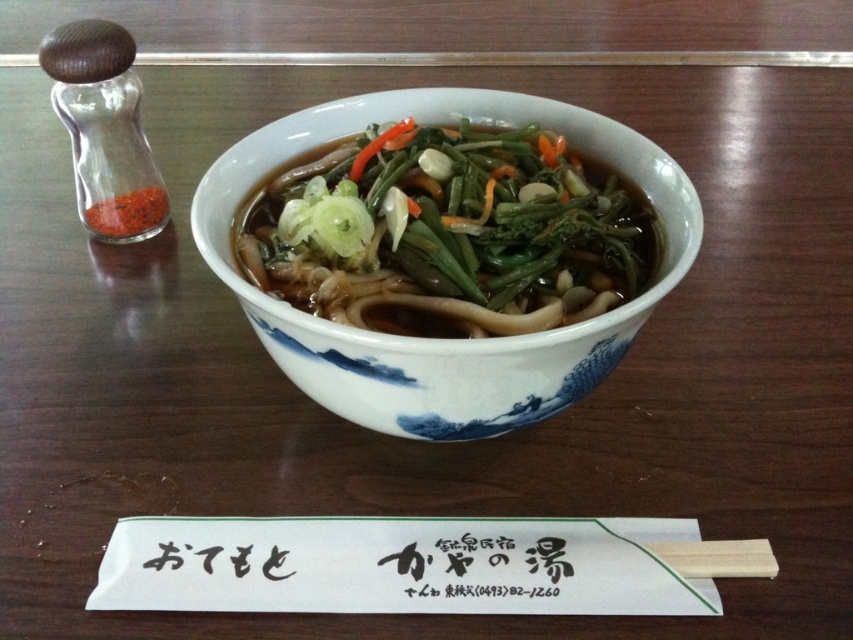
Question: Observing the image, what is the correct spatial positioning of white glossy bowl at center in reference to transparent glass container at left?

Choices:
 (A) right
 (B) left

Answer: (A)

Question: Which object appears closest to the camera in this image?

Choices:
 (A) white glossy bowl at center
 (B) transparent glass container at left

Answer: (A)

Question: Which object is farther from the camera taking this photo?

Choices:
 (A) transparent glass container at left
 (B) white glossy bowl at center

Answer: (A)

Question: Among these objects, which one is farthest from the camera?

Choices:
 (A) transparent glass container at left
 (B) white glossy bowl at center

Answer: (A)

Question: Observing the image, what is the correct spatial positioning of white glossy bowl at center in reference to transparent glass container at left?

Choices:
 (A) left
 (B) right

Answer: (B)

Question: Can you confirm if white glossy bowl at center is bigger than transparent glass container at left?

Choices:
 (A) yes
 (B) no

Answer: (A)